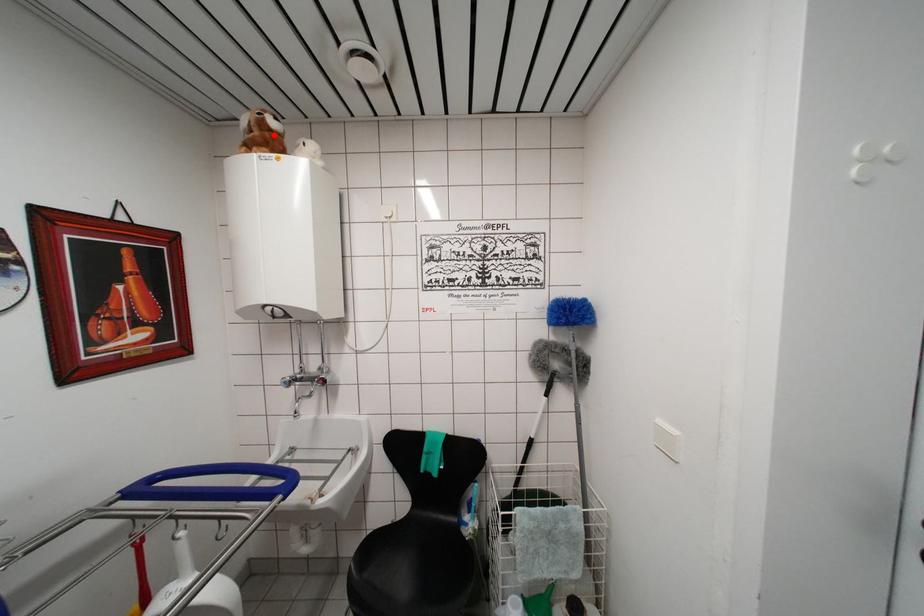
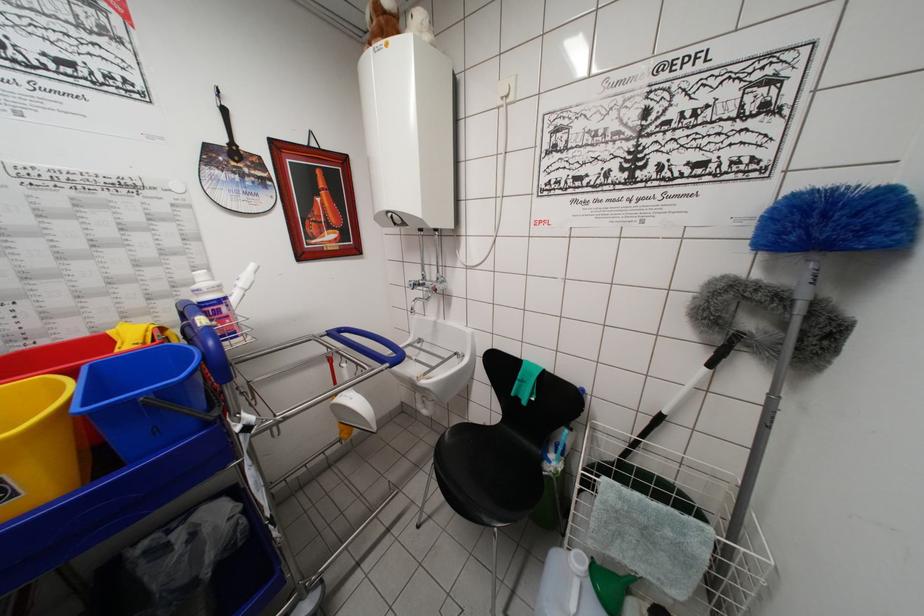
Find the pixel in the second image that matches the highlighted location in the first image.

(387, 17)